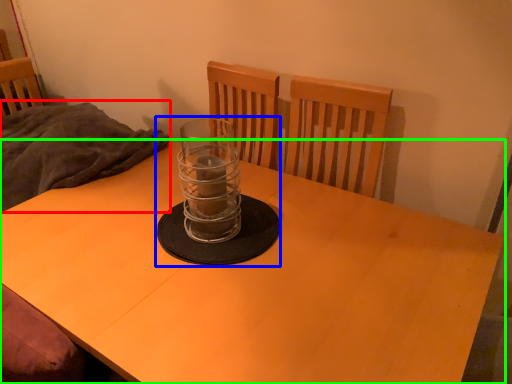
Question: Considering the real-world distances, which object is closest to blanket (highlighted by a red box)? candle holder (highlighted by a blue box) or desk (highlighted by a green box).

Choices:
 (A) candle holder
 (B) desk

Answer: (B)